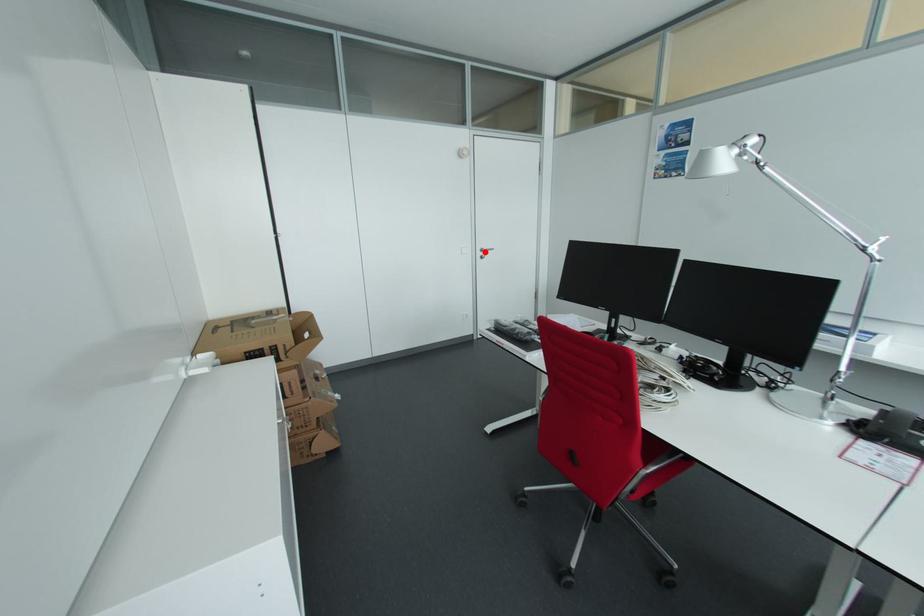
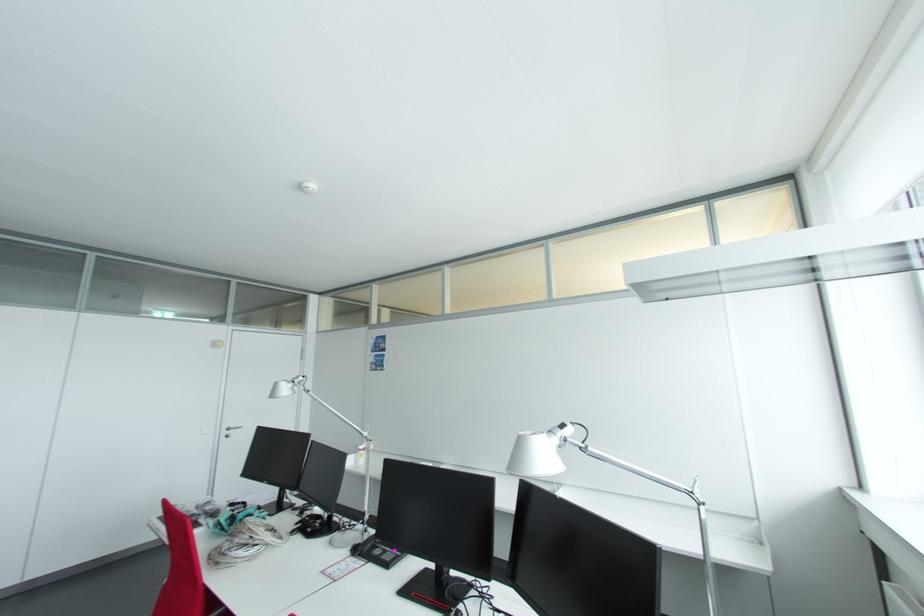
Question: I am providing you with two images of the same scene from different viewpoints. A red point is shown in image1. For the corresponding object point in image2, is it positioned nearer or farther from the camera?

Choices:
 (A) Nearer
 (B) Farther

Answer: (B)